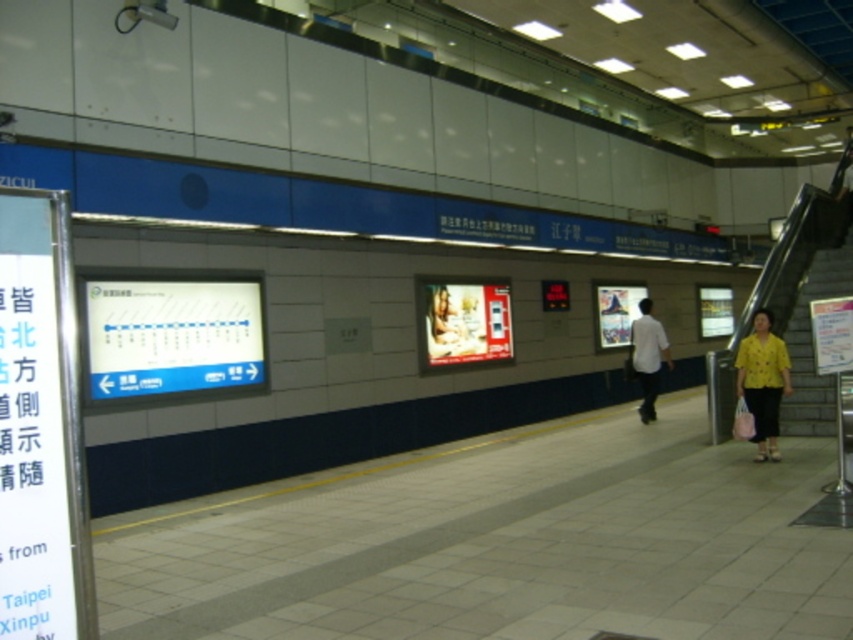
What do you see at coordinates (796, 307) in the screenshot? I see `yellow fabric escalator at right` at bounding box center [796, 307].

Who is shorter, yellow fabric escalator at right or white matte shirt at center?

yellow fabric escalator at right is shorter.

Between point (775, 264) and point (647, 369), which one is positioned in front?

Point (647, 369) is in front.

This screenshot has height=640, width=853. I want to click on yellow fabric escalator at right, so click(x=796, y=307).

Which is below, yellow fabric escalator at right or yellow fabric shirt at right?

yellow fabric shirt at right is below.

Is yellow fabric escalator at right shorter than yellow fabric shirt at right?

Correct, yellow fabric escalator at right is not as tall as yellow fabric shirt at right.

What are the coordinates of `yellow fabric escalator at right` in the screenshot? It's located at click(796, 307).

Is yellow fabric shirt at right closer to the viewer compared to white matte shirt at center?

Yes, yellow fabric shirt at right is in front of white matte shirt at center.

Based on the photo, how distant is yellow fabric shirt at right from white matte shirt at center?

yellow fabric shirt at right is 9.88 feet away from white matte shirt at center.

You are a GUI agent. You are given a task and a screenshot of the screen. Output one action in this format:
    pyautogui.click(x=<x>, y=<y>)
    Task: Click on the yellow fabric shirt at right
    
    Given the screenshot: What is the action you would take?
    pyautogui.click(x=763, y=381)